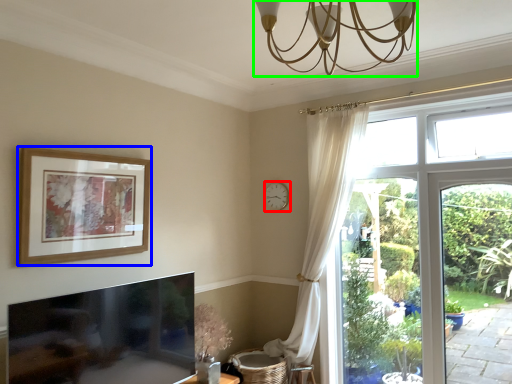
Question: Based on their relative distances, which object is farther from clock (highlighted by a red box)? Choose from picture frame (highlighted by a blue box) and light fixture (highlighted by a green box).

Choices:
 (A) picture frame
 (B) light fixture

Answer: (B)